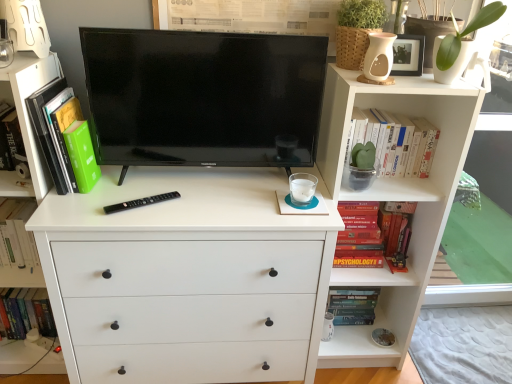
Locate an element on the screen. The width and height of the screenshot is (512, 384). empty space that is ontop of white matte chest of drawers at center (from a real-world perspective) is located at coordinates (180, 188).